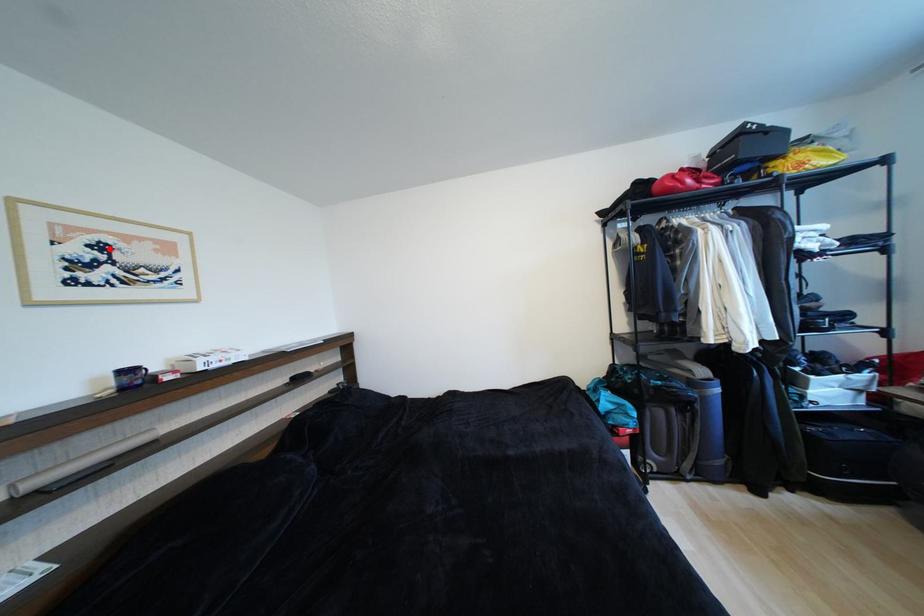
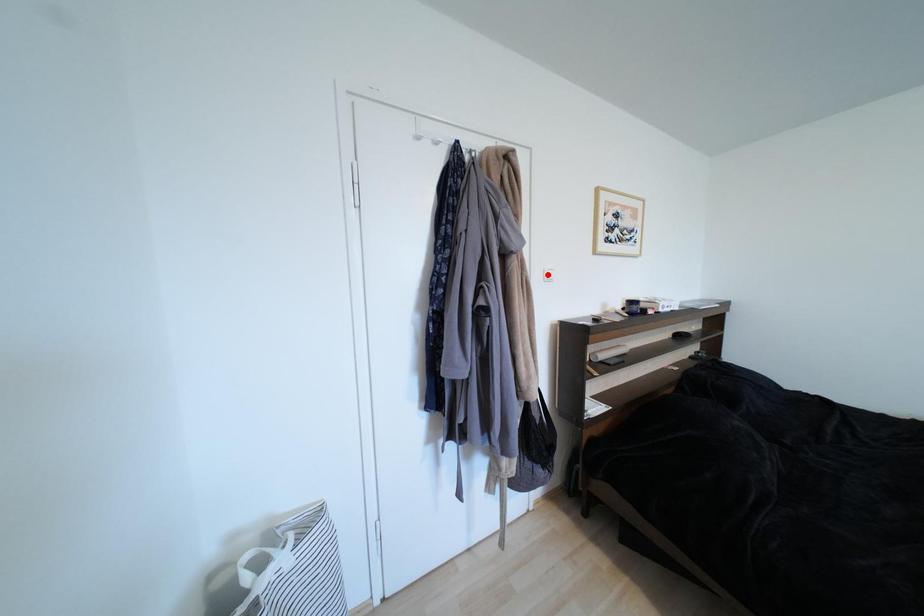
I am providing you with two images of the same scene from different viewpoints. A red point is marked on the first image and another point is marked on the second image. Is the marked point in image1 the same physical position as the marked point in image2?

No